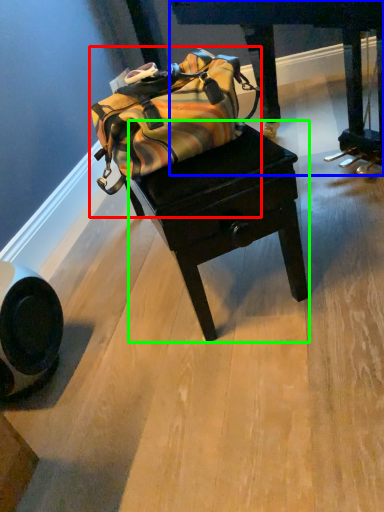
Question: Considering the real-world distances, which object is closest to luggage and bags (highlighted by a red box)? furniture (highlighted by a blue box) or table (highlighted by a green box).

Choices:
 (A) furniture
 (B) table

Answer: (B)